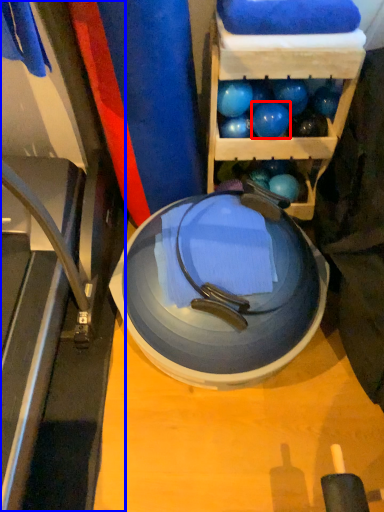
Question: Which object appears closest to the camera in this image, ball (highlighted by a red box) or treadmill (highlighted by a blue box)?

Choices:
 (A) ball
 (B) treadmill

Answer: (B)